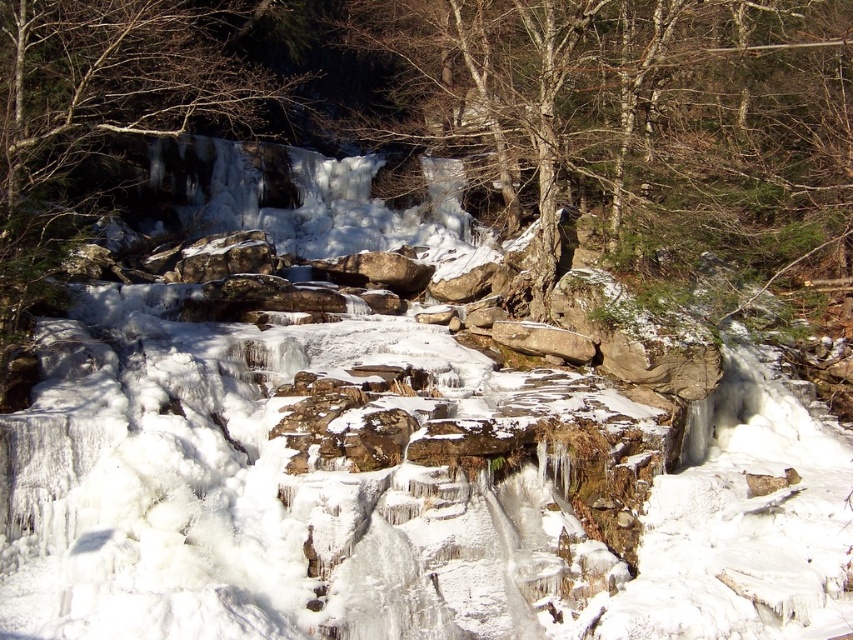
You are planning to hang a bird feeder between the bare wood tree at center and the smooth bark tree at upper left. The feeder requires a minimum distance of 100 feet between the two trees to support its weight. Can you safely install the feeder between them?

The distance between the bare wood tree at center and the smooth bark tree at upper left is 101.12 feet, which exceeds the minimum requirement of 100 feet. Therefore, you can safely install the feeder between them.

You are a photographer standing at the edge of the waterfall and want to take a photo that includes both the point at coordinates point (398, 77) and point (57, 205). Which point will appear closer to the front of the photo?

Point (398, 77) is further to the camera than point (57, 205), so the point at (398, 77) will appear closer to the front of the photo.

You are standing at point (634,115) in the winter landscape. What is the closest object to you?

The closest object to you at point (634,115) is the bare wood tree at center located exactly at that coordinate.